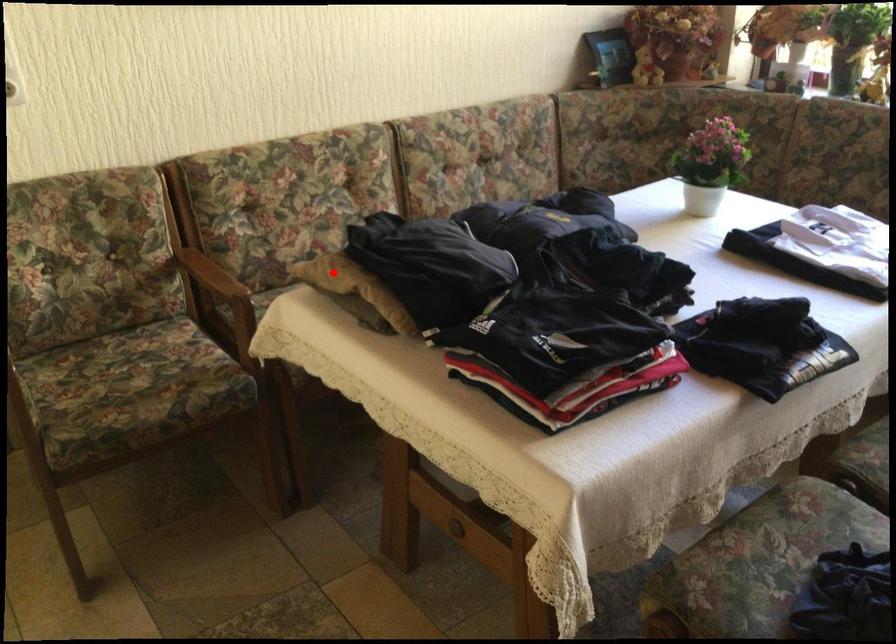
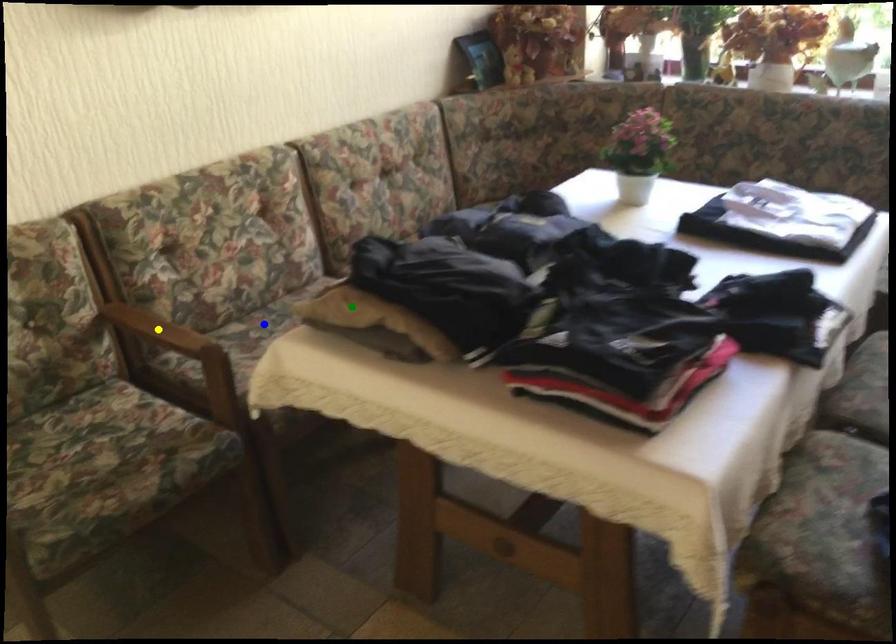
Question: I am providing you with two images of the same scene from different viewpoints. A red point is marked on the first image. You are given multiple points on the second image. Which point in image 2 represents the same 3d spot as the red point in image 1?

Choices:
 (A) yellow point
 (B) blue point
 (C) green point

Answer: (C)